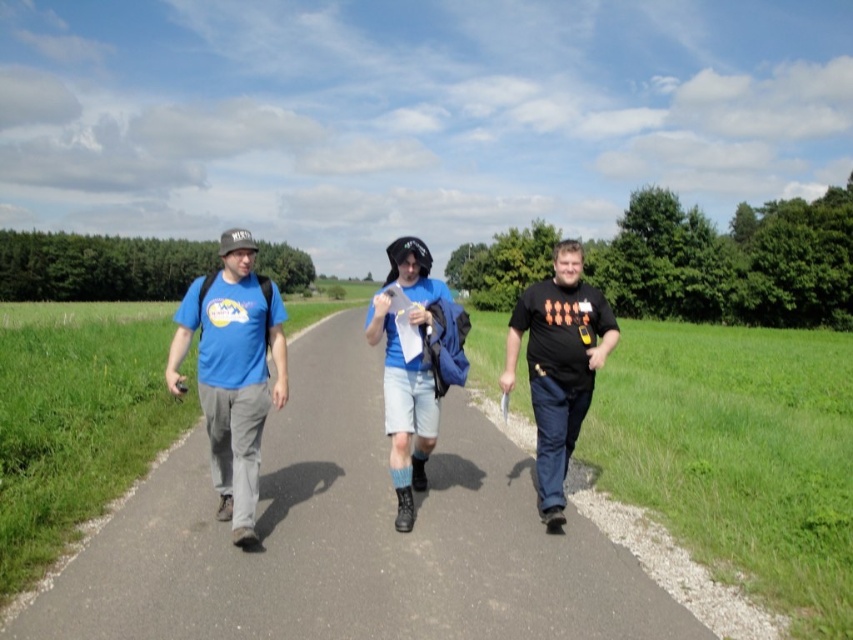
Question: Does matte blue t-shirt at left appear over blue cotton t-shirt at center?

Choices:
 (A) no
 (B) yes

Answer: (A)

Question: Does smooth asphalt road at center have a greater width compared to black matte t-shirt at center?

Choices:
 (A) no
 (B) yes

Answer: (B)

Question: Which is farther from the matte blue t-shirt at left?

Choices:
 (A) blue cotton t-shirt at center
 (B) black matte t-shirt at center

Answer: (B)

Question: Which point is closer to the camera?

Choices:
 (A) (206, 321)
 (B) (271, 337)

Answer: (A)

Question: Estimate the real-world distances between objects in this image. Which object is closer to the matte blue t-shirt at left?

Choices:
 (A) blue cotton t-shirt at center
 (B) black matte t-shirt at center
 (C) smooth asphalt road at center

Answer: (A)

Question: Where is smooth asphalt road at center located in relation to black matte t-shirt at center in the image?

Choices:
 (A) below
 (B) above

Answer: (A)